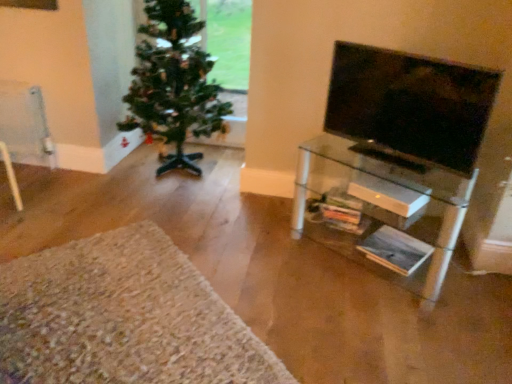
Question: From the image's perspective, does clear glass shelf at right appear lower than black glossy tv at right?

Choices:
 (A) no
 (B) yes

Answer: (B)

Question: Considering the relative positions of clear glass shelf at right and black glossy tv at right in the image provided, is clear glass shelf at right to the right of black glossy tv at right from the viewer's perspective?

Choices:
 (A) no
 (B) yes

Answer: (B)

Question: From the image's perspective, does clear glass shelf at right appear higher than black glossy tv at right?

Choices:
 (A) yes
 (B) no

Answer: (B)

Question: Is clear glass shelf at right facing away from black glossy tv at right?

Choices:
 (A) yes
 (B) no

Answer: (B)

Question: Considering the relative sizes of clear glass shelf at right and black glossy tv at right in the image provided, is clear glass shelf at right smaller than black glossy tv at right?

Choices:
 (A) yes
 (B) no

Answer: (B)

Question: Is clear glass shelf at right far away from black glossy tv at right?

Choices:
 (A) yes
 (B) no

Answer: (B)

Question: Can you confirm if black glossy tv at right is wider than green matte christmas tree at left?

Choices:
 (A) no
 (B) yes

Answer: (A)

Question: Considering the relative sizes of black glossy tv at right and green matte christmas tree at left in the image provided, is black glossy tv at right bigger than green matte christmas tree at left?

Choices:
 (A) no
 (B) yes

Answer: (A)

Question: Is black glossy tv at right not close to green matte christmas tree at left?

Choices:
 (A) no
 (B) yes

Answer: (B)

Question: Does black glossy tv at right appear on the left side of green matte christmas tree at left?

Choices:
 (A) yes
 (B) no

Answer: (B)

Question: From a real-world perspective, is black glossy tv at right on green matte christmas tree at left?

Choices:
 (A) no
 (B) yes

Answer: (B)

Question: Can you confirm if black glossy tv at right is shorter than green matte christmas tree at left?

Choices:
 (A) no
 (B) yes

Answer: (B)

Question: From the image's perspective, would you say clear glass shelf at right is shown under green matte christmas tree at left?

Choices:
 (A) no
 (B) yes

Answer: (B)